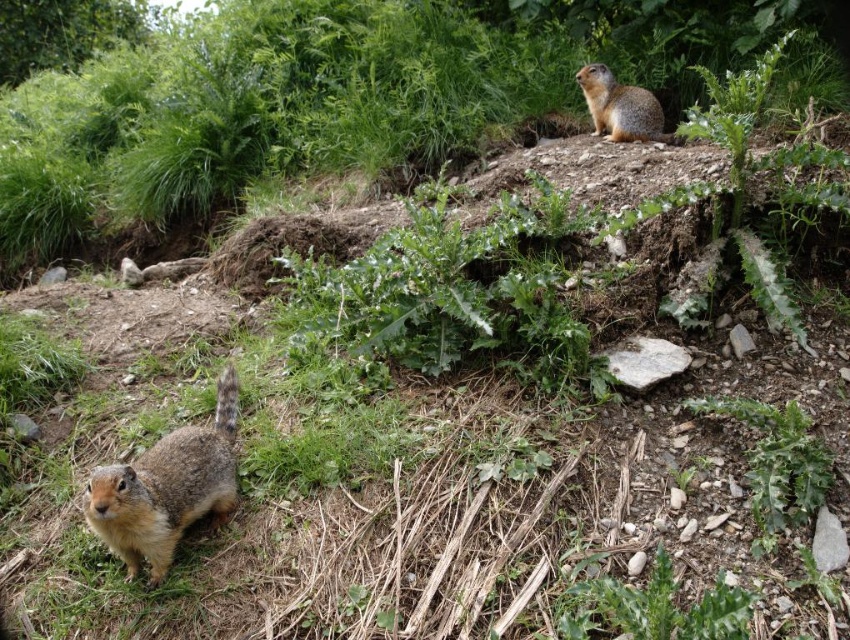
Question: Which point is farther to the camera?

Choices:
 (A) (642, 109)
 (B) (146, 483)

Answer: (A)

Question: Considering the relative positions of green leafy plants at upper center and brown fur squirrel at upper right in the image provided, where is green leafy plants at upper center located with respect to brown fur squirrel at upper right?

Choices:
 (A) right
 (B) left

Answer: (B)

Question: Does green leafy plants at upper center have a larger size compared to brown fur squirrel at lower left?

Choices:
 (A) yes
 (B) no

Answer: (A)

Question: Which object is positioned closest to the green leafy plants at upper center?

Choices:
 (A) brown fur squirrel at lower left
 (B) brown fur squirrel at upper right

Answer: (B)

Question: Does green leafy plants at upper center appear under brown fur squirrel at lower left?

Choices:
 (A) no
 (B) yes

Answer: (A)

Question: Among these points, which one is farthest from the camera?

Choices:
 (A) (435, 97)
 (B) (146, 467)
 (C) (599, 64)

Answer: (A)